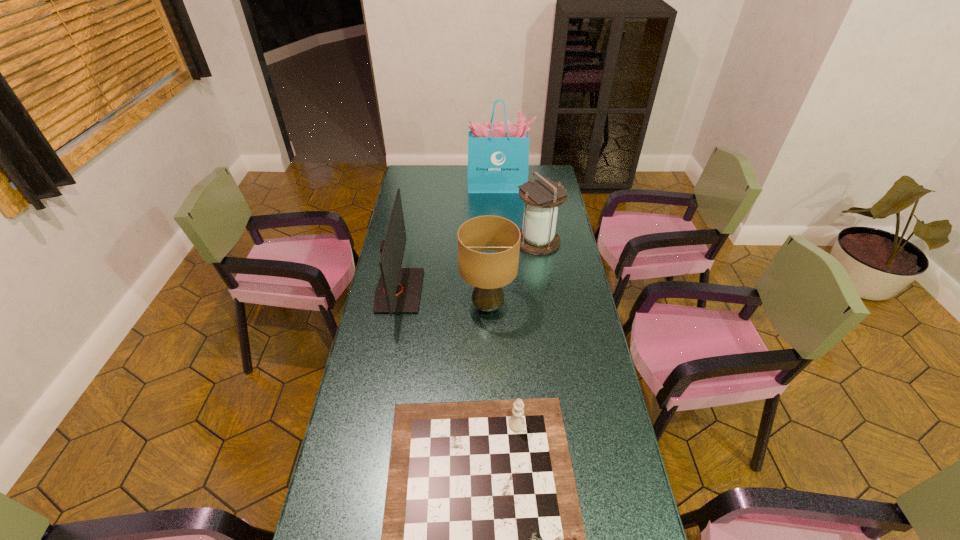
This screenshot has width=960, height=540. In order to click on object present at the left edge in this screenshot , I will do `click(398, 290)`.

Locate an element on the screen. This screenshot has height=540, width=960. shopping bag present at the right edge is located at coordinates (498, 153).

Image resolution: width=960 pixels, height=540 pixels. Find the location of `lantern at the right edge`. lantern at the right edge is located at coordinates pos(542,197).

At what (x,y) coordinates should I click in order to perform the action: click on object located at the far right corner. Please return your answer as a coordinate pair (x, y). This screenshot has height=540, width=960. Looking at the image, I should click on (498, 153).

Identify the location of free spot at the far edge of the desktop. (449, 173).

Where is `free space at the left edge of the desktop`? The image size is (960, 540). free space at the left edge of the desktop is located at coordinates (385, 409).

At what (x,y) coordinates should I click in order to perform the action: click on free location at the right edge. Please return your answer as a coordinate pair (x, y). The height and width of the screenshot is (540, 960). Looking at the image, I should click on (620, 491).

In the image, there is a desktop. Where is `free region at the far right corner`? free region at the far right corner is located at coordinates (546, 168).

At what (x,y) coordinates should I click in order to perform the action: click on free space that is in between the monitor and the farthest object. Please return your answer as a coordinate pair (x, y). This screenshot has height=540, width=960. Looking at the image, I should click on (448, 239).

Locate an element on the screen. The width and height of the screenshot is (960, 540). object that stands as the fourth closest to the gameboard is located at coordinates (498, 153).